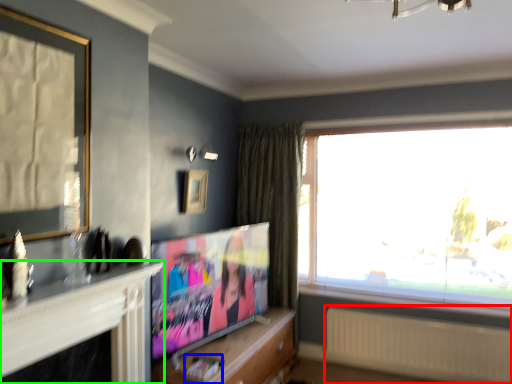
Question: Considering the real-world distances, which object is farthest from radiator (highlighted by a red box)? magazine (highlighted by a blue box) or fireplace (highlighted by a green box)?

Choices:
 (A) magazine
 (B) fireplace

Answer: (B)